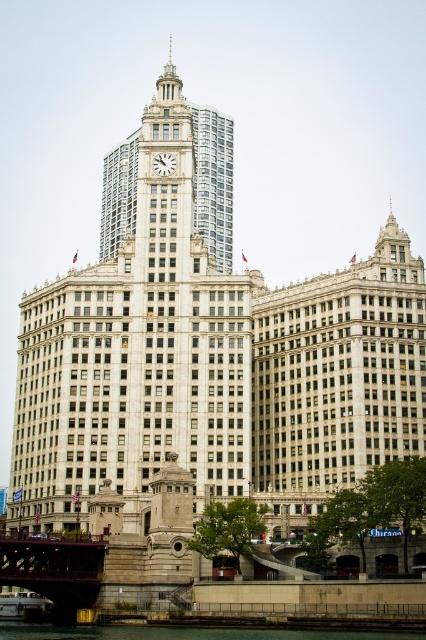
Question: Among these points, which one is farthest from the camera?

Choices:
 (A) (198, 106)
 (B) (37, 552)
 (C) (103, 634)
 (D) (172, 168)

Answer: (A)

Question: Which point is closer to the camera?

Choices:
 (A) (169, 176)
 (B) (212, 211)
 (C) (16, 548)
 (D) (253, 634)

Answer: (D)

Question: Is white marble clock tower at center positioned at the back of green concrete river at lower center?

Choices:
 (A) yes
 (B) no

Answer: (A)

Question: From the image, what is the correct spatial relationship of brown metal bridge at lower left in relation to white marble clock at center?

Choices:
 (A) above
 (B) below

Answer: (B)

Question: Which point is closer to the camera?

Choices:
 (A) green concrete river at lower center
 (B) white marble clock tower at center
 (C) brown metal bridge at lower left
 (D) white marble clock at center

Answer: (A)

Question: Does green concrete river at lower center appear on the right side of white marble clock at center?

Choices:
 (A) yes
 (B) no

Answer: (A)